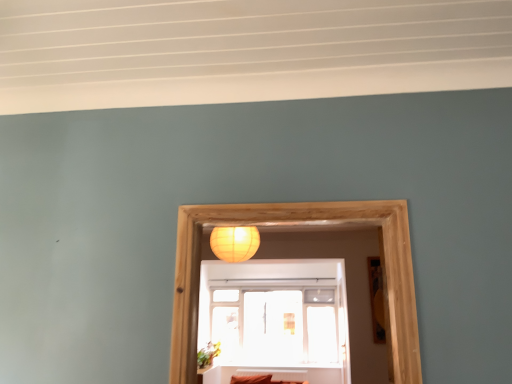
You are a GUI agent. You are given a task and a screenshot of the screen. Output one action in this format:
    pyautogui.click(x=<x>, y=<y>)
    Task: Click on the transparent glass window at center
    The width and height of the screenshot is (512, 384).
    Given the screenshot: What is the action you would take?
    pyautogui.click(x=276, y=319)

The image size is (512, 384). Describe the element at coordinates (234, 243) in the screenshot. I see `matte yellow paper lantern at upper center` at that location.

Find the location of a particular element. transparent glass window at center is located at coordinates (276, 319).

Measure the distance between wooden picture frame at right and transparent glass window at center.

wooden picture frame at right and transparent glass window at center are 7.23 feet apart.

Based on the photo, is wooden picture frame at right aimed at transparent glass window at center?

Result: No, wooden picture frame at right is not aimed at transparent glass window at center.

Is wooden picture frame at right positioned far away from transparent glass window at center?

Yes.

From the picture: From a real-world perspective, is wooden picture frame at right over transparent glass window at center?

Correct, in the physical world, wooden picture frame at right is higher than transparent glass window at center.

Find the location of a particular element. Image resolution: width=512 pixels, height=384 pixels. picture frame below the matte yellow paper lantern at upper center (from the image's perspective) is located at coordinates (x=376, y=299).

Is point (382, 321) positioned in front of point (219, 231)?

Yes.

Is wooden picture frame at right not close to matte yellow paper lantern at upper center?

wooden picture frame at right is positioned a significant distance from matte yellow paper lantern at upper center.

Considering the sizes of objects wooden picture frame at right and matte yellow paper lantern at upper center in the image provided, who is smaller, wooden picture frame at right or matte yellow paper lantern at upper center?

wooden picture frame at right.

From a real-world perspective, is transparent glass window at center positioned under matte yellow paper lantern at upper center based on gravity?

Yes, from a real-world perspective, transparent glass window at center is under matte yellow paper lantern at upper center.

Can you confirm if transparent glass window at center is wider than matte yellow paper lantern at upper center?

Incorrect, the width of transparent glass window at center does not surpass that of matte yellow paper lantern at upper center.

The width and height of the screenshot is (512, 384). In the image, there is a transparent glass window at center. In order to click on lamp above it (from the image's perspective) in this screenshot , I will do `click(234, 243)`.

Considering the relative positions of transparent glass window at center and matte yellow paper lantern at upper center in the image provided, is transparent glass window at center to the left of matte yellow paper lantern at upper center from the viewer's perspective?

In fact, transparent glass window at center is to the right of matte yellow paper lantern at upper center.

From the image's perspective, is matte yellow paper lantern at upper center above or below transparent glass window at center?

matte yellow paper lantern at upper center is above transparent glass window at center.

How many degrees apart are the facing directions of matte yellow paper lantern at upper center and transparent glass window at center?

matte yellow paper lantern at upper center and transparent glass window at center are facing 2.94 degrees away from each other.

Considering the relative sizes of matte yellow paper lantern at upper center and transparent glass window at center in the image provided, is matte yellow paper lantern at upper center wider than transparent glass window at center?

Correct, the width of matte yellow paper lantern at upper center exceeds that of transparent glass window at center.

Does matte yellow paper lantern at upper center appear on the left side of transparent glass window at center?

Indeed, matte yellow paper lantern at upper center is positioned on the left side of transparent glass window at center.

Which of these two, matte yellow paper lantern at upper center or wooden picture frame at right, stands taller?

wooden picture frame at right.

Is matte yellow paper lantern at upper center aimed at wooden picture frame at right?

No, matte yellow paper lantern at upper center is not aimed at wooden picture frame at right.

From a real-world perspective, is matte yellow paper lantern at upper center over wooden picture frame at right?

Yes.

How far apart are transparent glass window at center and wooden picture frame at right?

2.20 meters.

What are the coordinates of `picture frame on the right side of transparent glass window at center` in the screenshot? It's located at (376, 299).

Does transparent glass window at center have a larger size compared to wooden picture frame at right?

Yes, transparent glass window at center is bigger than wooden picture frame at right.

I want to click on window lying below the wooden picture frame at right (from the image's perspective), so click(276, 319).

Locate an element on the screen. The image size is (512, 384). picture frame behind the matte yellow paper lantern at upper center is located at coordinates (376, 299).

Estimate the real-world distances between objects in this image. Which object is further from matte yellow paper lantern at upper center, wooden picture frame at right or transparent glass window at center?

wooden picture frame at right.

Based on their spatial positions, is transparent glass window at center or wooden picture frame at right further from matte yellow paper lantern at upper center?

Based on the image, wooden picture frame at right appears to be further to matte yellow paper lantern at upper center.

Estimate the real-world distances between objects in this image. Which object is closer to wooden picture frame at right, matte yellow paper lantern at upper center or transparent glass window at center?

matte yellow paper lantern at upper center is positioned closer to the anchor wooden picture frame at right.

From the image, which object appears to be farther from wooden picture frame at right, transparent glass window at center or matte yellow paper lantern at upper center?

transparent glass window at center.

Looking at the image, which one is located closer to transparent glass window at center, wooden picture frame at right or matte yellow paper lantern at upper center?

matte yellow paper lantern at upper center lies closer to transparent glass window at center than the other object.

Estimate the real-world distances between objects in this image. Which object is further from transparent glass window at center, matte yellow paper lantern at upper center or wooden picture frame at right?

Among the two, wooden picture frame at right is located further to transparent glass window at center.

Image resolution: width=512 pixels, height=384 pixels. Find the location of `picture frame located between matte yellow paper lantern at upper center and transparent glass window at center in the depth direction`. picture frame located between matte yellow paper lantern at upper center and transparent glass window at center in the depth direction is located at coordinates (376, 299).